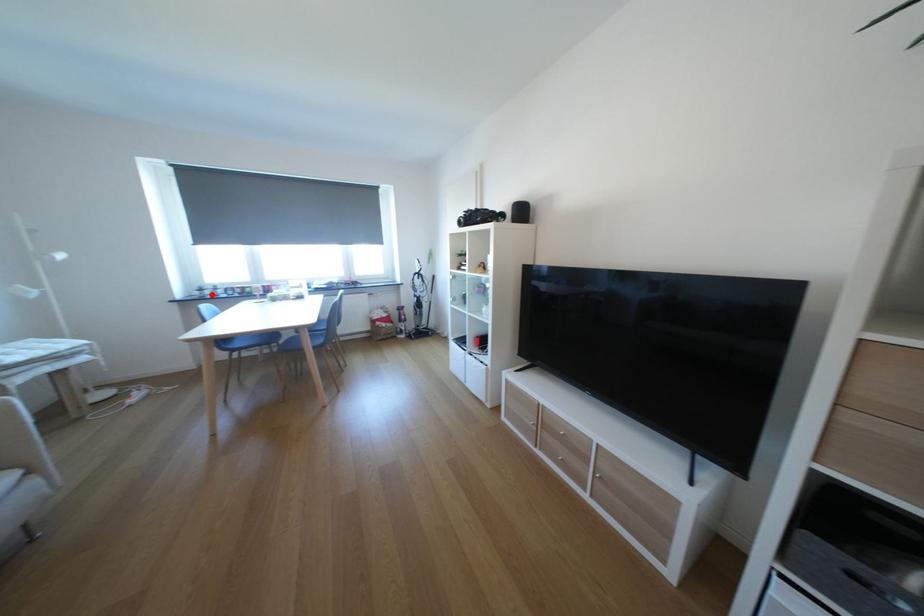
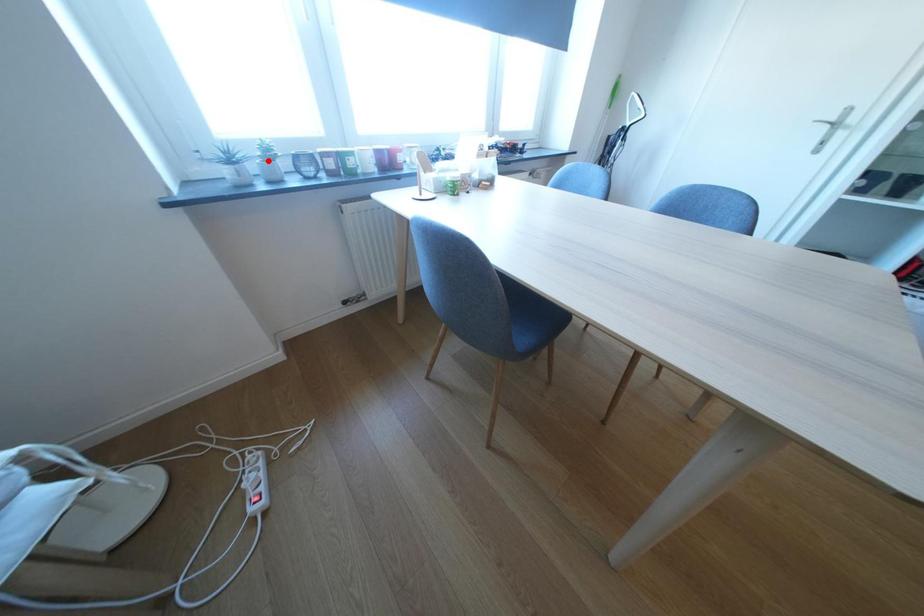
I am providing you with two images of the same scene from different viewpoints. A red point is marked on the first image and another point is marked on the second image. Does the point marked in image1 correspond to the same location as the one in image2?

No